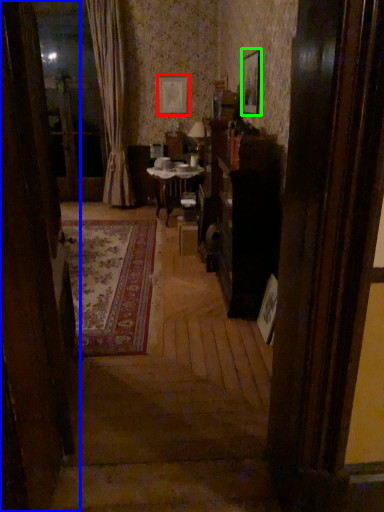
Question: Considering the real-world distances, which object is farthest from picture frame (highlighted by a red box)? furniture (highlighted by a blue box) or picture frame (highlighted by a green box)?

Choices:
 (A) furniture
 (B) picture frame

Answer: (A)